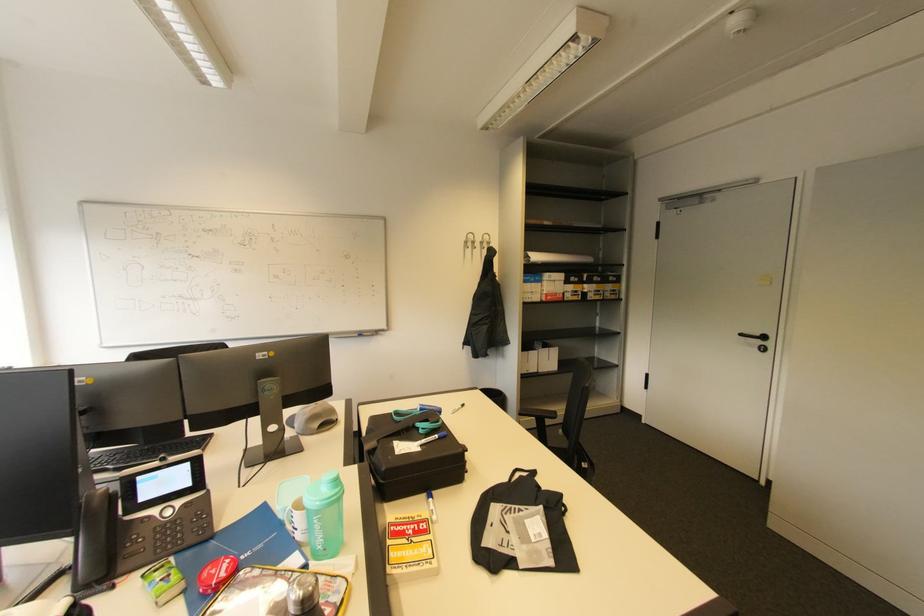
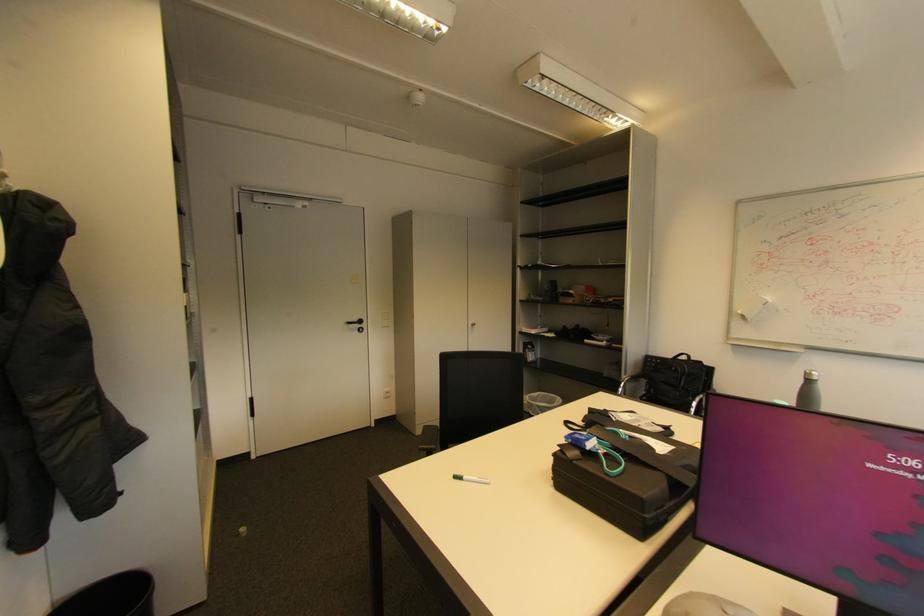
In the second image, find the point that corresponds to pixel 769 339 in the first image.

(366, 322)